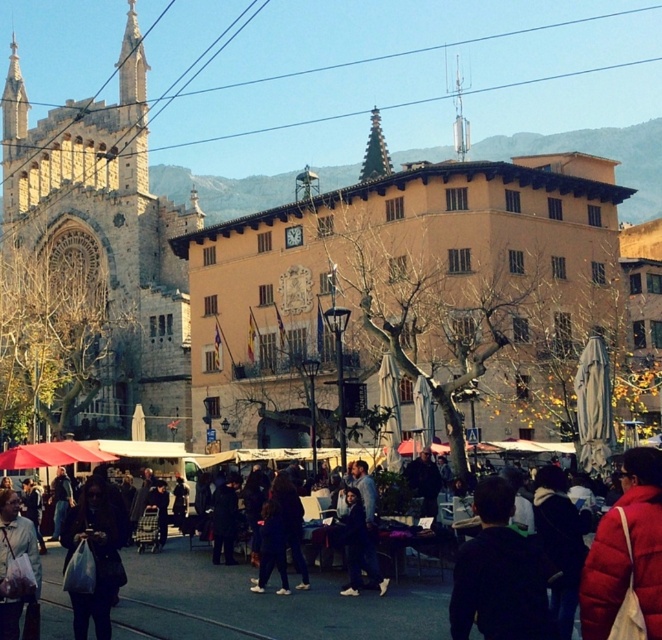
Question: Is matte red jacket at center wider than matte black jacket at lower left?

Choices:
 (A) no
 (B) yes

Answer: (A)

Question: Can you confirm if stone church at left is positioned below dark brown hair at center?

Choices:
 (A) no
 (B) yes

Answer: (A)

Question: Which point is closer to the camera?

Choices:
 (A) (73, 580)
 (B) (592, 564)
 (C) (496, 536)

Answer: (B)

Question: Can you confirm if matte red jacket at center is thinner than white fabric bag at lower left?

Choices:
 (A) yes
 (B) no

Answer: (B)

Question: Among these points, which one is farthest from the camera?

Choices:
 (A) (606, 628)
 (B) (26, 538)

Answer: (B)

Question: Which point is closer to the camera?

Choices:
 (A) matte red jacket at center
 (B) stone church at left
 (C) matte black jacket at lower left

Answer: (A)